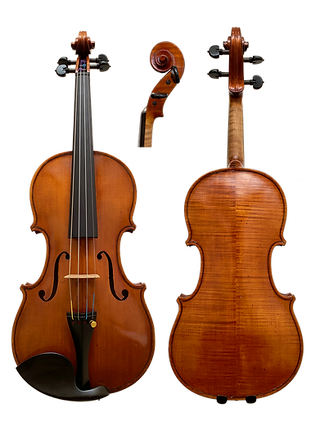
Locate an element on the screen. Image resolution: width=320 pixels, height=430 pixels. knob is located at coordinates (64, 60).